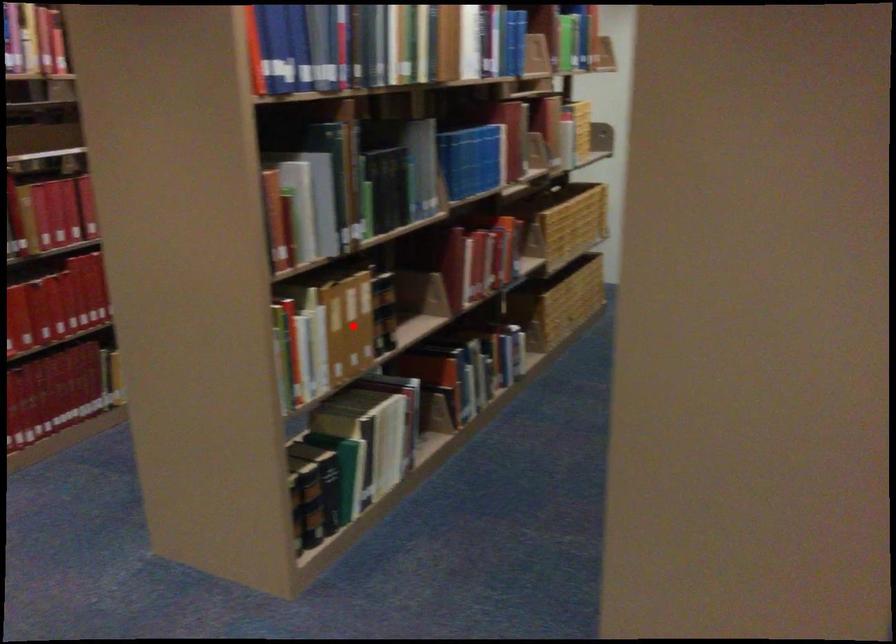
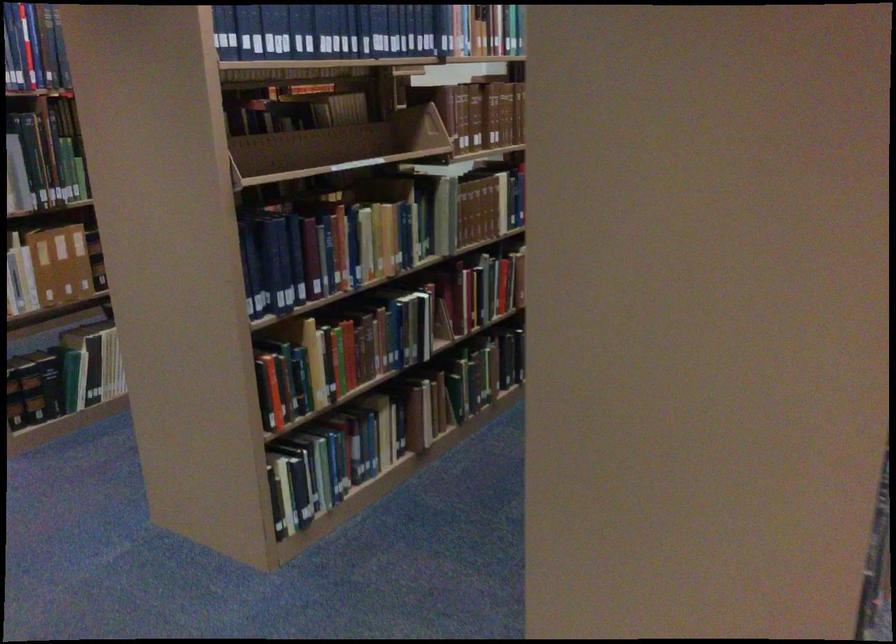
Question: I am providing you with two images of the same scene from different viewpoints. Image1 has a red point marked. In image2, the corresponding 3D location appears at what relative position? Reply with the corresponding letter.

Choices:
 (A) Closer
 (B) Farther

Answer: (B)